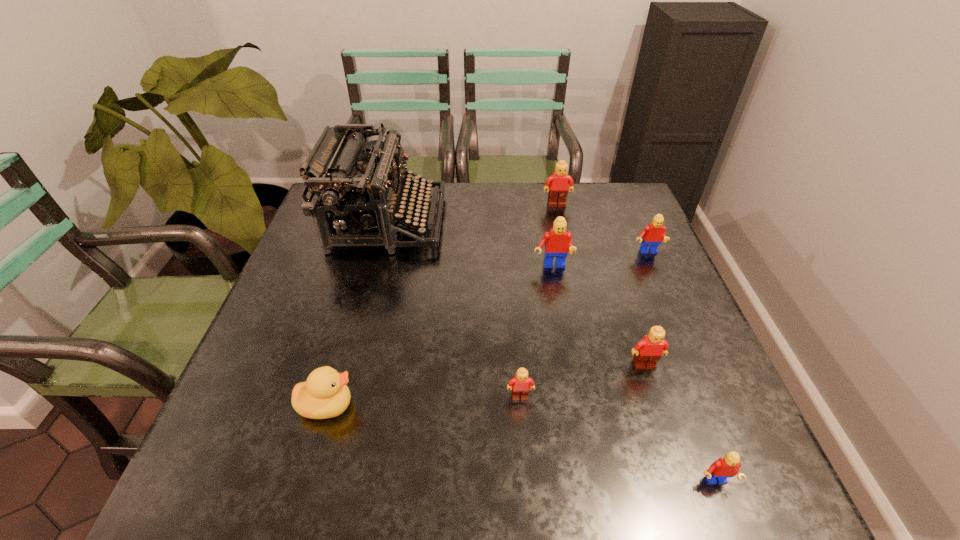
Image resolution: width=960 pixels, height=540 pixels. Find the location of `free space between the tallest object and the nearest red Lego`. free space between the tallest object and the nearest red Lego is located at coordinates (551, 352).

Find the location of a particular element. The width and height of the screenshot is (960, 540). empty space that is in between the typewriter and the biggest red Lego is located at coordinates (469, 244).

Find the location of a particular element. This screenshot has height=540, width=960. free area in between the biggest brown Lego and the second biggest brown Lego is located at coordinates (600, 285).

Identify which object is located as the fourth nearest to the second nearest Lego. Please provide its 2D coordinates. Your answer should be formatted as a tuple, i.e. [(x, y)], where the tuple contains the x and y coordinates of a point satisfying the conditions above.

[(558, 242)]

Identify which object is the third closest to the second biggest brown Lego. Please provide its 2D coordinates. Your answer should be formatted as a tuple, i.e. [(x, y)], where the tuple contains the x and y coordinates of a point satisfying the conditions above.

[(558, 242)]

Point out which Lego is positioned as the third nearest to the tallest object. Please provide its 2D coordinates. Your answer should be formatted as a tuple, i.e. [(x, y)], where the tuple contains the x and y coordinates of a point satisfying the conditions above.

[(519, 385)]

Locate which Lego is the third closest to the nearest red Lego. Please provide its 2D coordinates. Your answer should be formatted as a tuple, i.e. [(x, y)], where the tuple contains the x and y coordinates of a point satisfying the conditions above.

[(558, 242)]

Find the location of a particular element. The image size is (960, 540). brown Lego that stands as the second closest to the biggest brown Lego is located at coordinates (519, 385).

Where is `brown Lego that stands as the closest to the second nearest brown Lego`? The height and width of the screenshot is (540, 960). brown Lego that stands as the closest to the second nearest brown Lego is located at coordinates (519, 385).

Where is `red Lego that is the second nearest to the farthest red Lego`? This screenshot has height=540, width=960. red Lego that is the second nearest to the farthest red Lego is located at coordinates (725, 467).